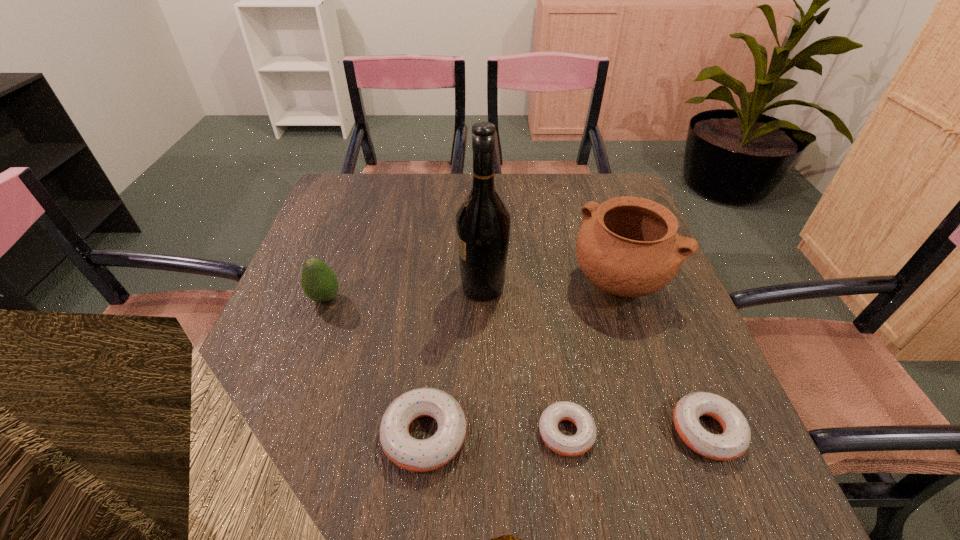
Select which doughnut appears as the third closest to the leftmost object. Please provide its 2D coordinates. Your answer should be formatted as a tuple, i.e. [(x, y)], where the tuple contains the x and y coordinates of a point satisfying the conditions above.

[(734, 441)]

I want to click on vacant region that satisfies the following two spatial constraints: 1. on the label of the tallest object; 2. on the front side of the tallest doughnut, so click(484, 435).

This screenshot has height=540, width=960. Identify the location of free space that satisfies the following two spatial constraints: 1. on the label of the rightmost doughnut; 2. on the right side of the tallest object. (484, 431).

The width and height of the screenshot is (960, 540). Identify the location of vacant region that satisfies the following two spatial constraints: 1. on the back side of the second tallest object; 2. on the right side of the tallest doughnut. (440, 284).

You are a GUI agent. You are given a task and a screenshot of the screen. Output one action in this format:
    pyautogui.click(x=<x>, y=<y>)
    Task: Click on the free space that satisfies the following two spatial constraints: 1. on the label of the wine bottle; 2. on the front side of the third tallest object
    The image size is (960, 540).
    Given the screenshot: What is the action you would take?
    pyautogui.click(x=483, y=298)